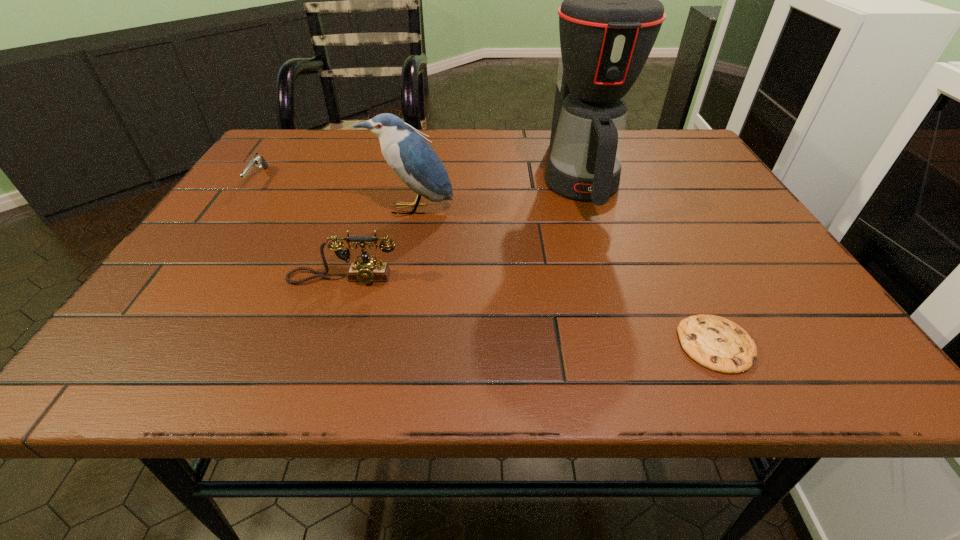
Locate an element on the screen. The width and height of the screenshot is (960, 540). blank region between the bird and the leftmost object is located at coordinates (335, 194).

At what (x,y) coordinates should I click in order to perform the action: click on empty space that is in between the coffee maker and the bird. Please return your answer as a coordinate pair (x, y). The width and height of the screenshot is (960, 540). Looking at the image, I should click on (495, 194).

Image resolution: width=960 pixels, height=540 pixels. I want to click on blank region between the fourth shortest object and the third tallest object, so click(377, 244).

At what (x,y) coordinates should I click in order to perform the action: click on free spot between the fourth tallest object and the bird. Please return your answer as a coordinate pair (x, y). The width and height of the screenshot is (960, 540). Looking at the image, I should click on tap(335, 194).

You are a GUI agent. You are given a task and a screenshot of the screen. Output one action in this format:
    pyautogui.click(x=<x>, y=<y>)
    Task: Click on the object that ranks as the second closest to the fourth tallest object
    
    Given the screenshot: What is the action you would take?
    (x=367, y=270)

Locate which object ranks second in proximity to the second nearest object. Please provide its 2D coordinates. Your answer should be formatted as a tuple, i.e. [(x, y)], where the tuple contains the x and y coordinates of a point satisfying the conditions above.

[(257, 161)]

Identify the location of vacant point that satisfies the following two spatial constraints: 1. on the front-facing side of the leftmost object; 2. on the left side of the nearest object. Image resolution: width=960 pixels, height=540 pixels. (142, 345).

Where is `vacant point that satisfies the following two spatial constraints: 1. on the front-facing side of the nearest object; 2. on the right side of the second nearest object`? The image size is (960, 540). vacant point that satisfies the following two spatial constraints: 1. on the front-facing side of the nearest object; 2. on the right side of the second nearest object is located at coordinates (322, 345).

The width and height of the screenshot is (960, 540). What are the coordinates of `blank space that satisfies the following two spatial constraints: 1. on the front-facing side of the shortest object; 2. on the right side of the second nearest object` in the screenshot? It's located at (322, 345).

Locate an element on the screen. This screenshot has width=960, height=540. free space that satisfies the following two spatial constraints: 1. on the front-facing side of the nearest object; 2. on the right side of the second shortest object is located at coordinates (142, 345).